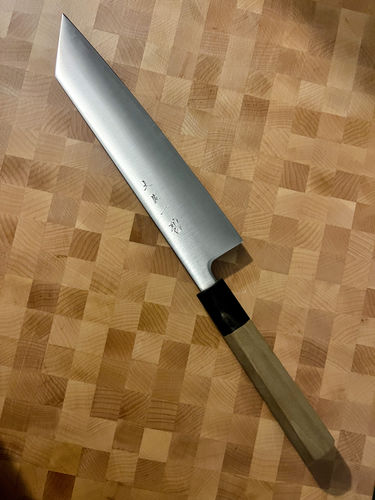
I want to click on handle, so click(275, 383).